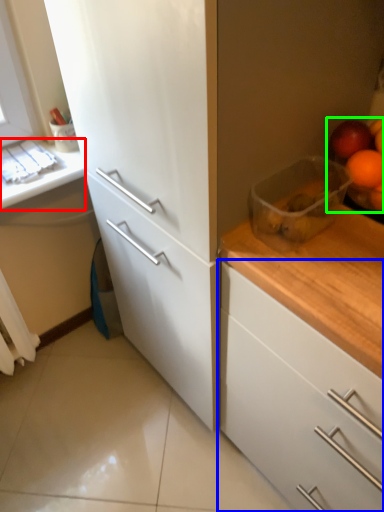
Question: Considering the real-world distances, which object is closest to counter top (highlighted by a red box)? cabinetry (highlighted by a blue box) or fruit (highlighted by a green box).

Choices:
 (A) cabinetry
 (B) fruit

Answer: (B)